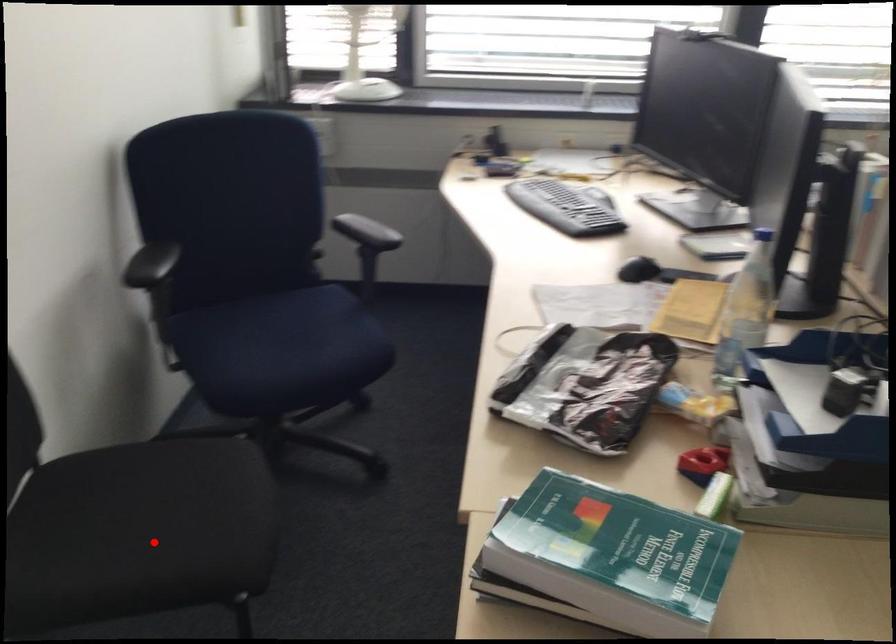
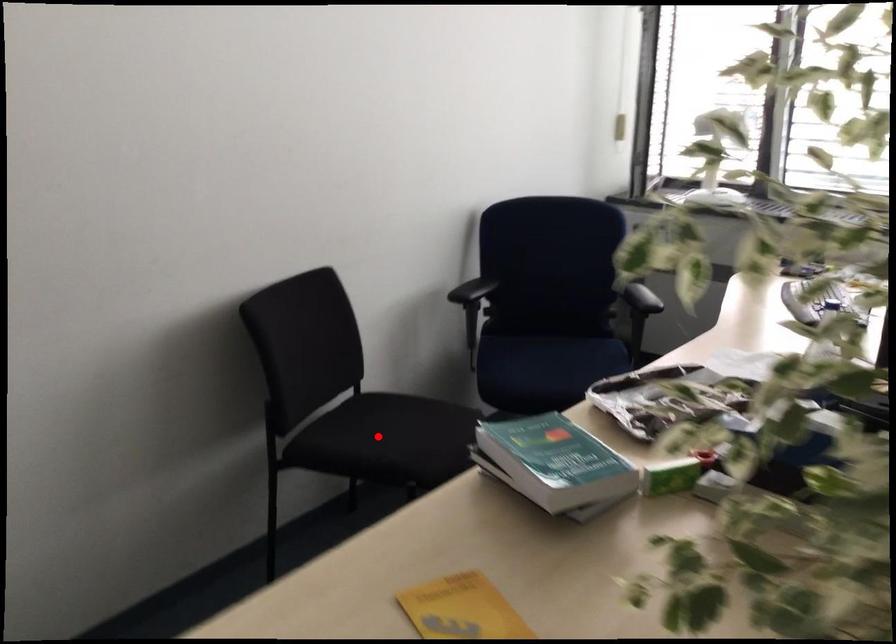
I am providing you with two images of the same scene from different viewpoints. A red point is marked on the first image and another point is marked on the second image. Is the red point in image1 aligned with the point shown in image2?

Yes